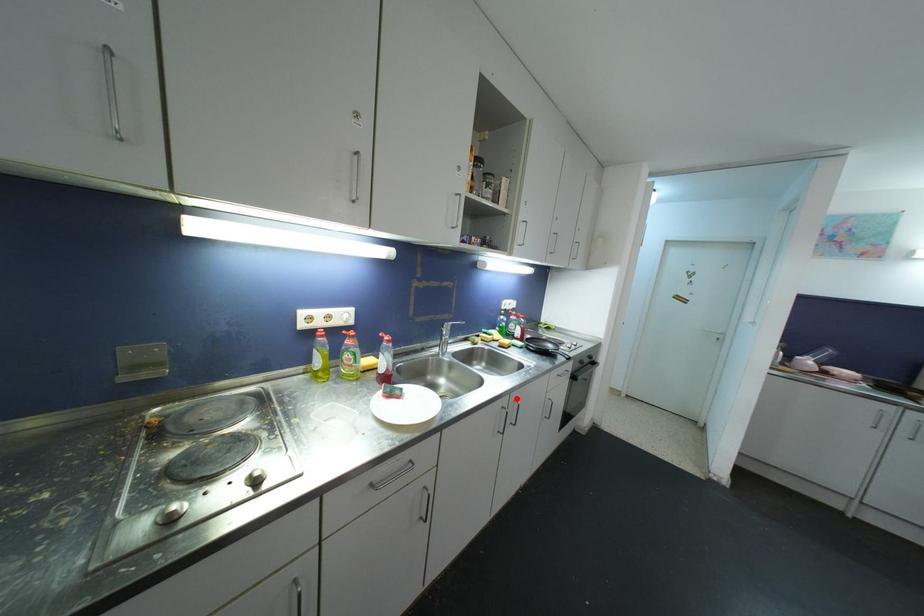
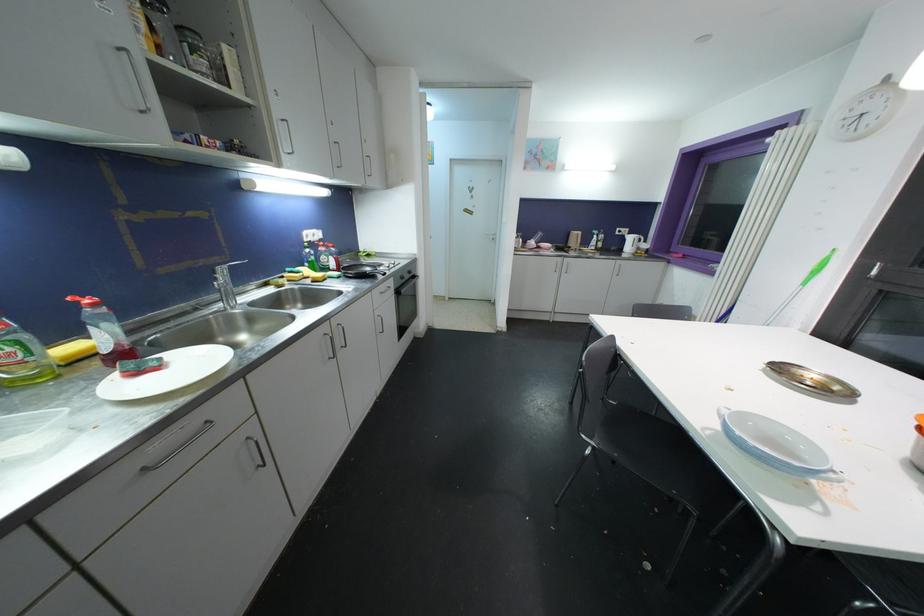
Find the pixel in the second image that matches the highlighted location in the first image.

(337, 323)